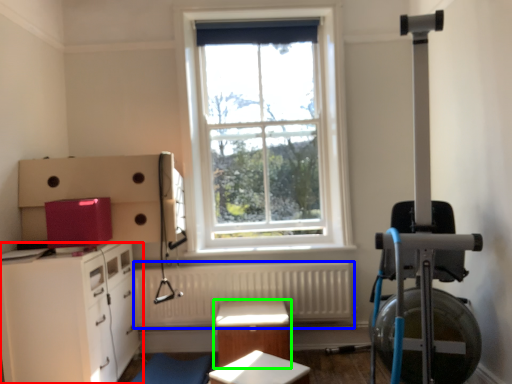
Question: Which object is the farthest from chest of drawers (highlighted by a red box)? Choose among these: radiator (highlighted by a blue box) or table (highlighted by a green box).

Choices:
 (A) radiator
 (B) table

Answer: (B)